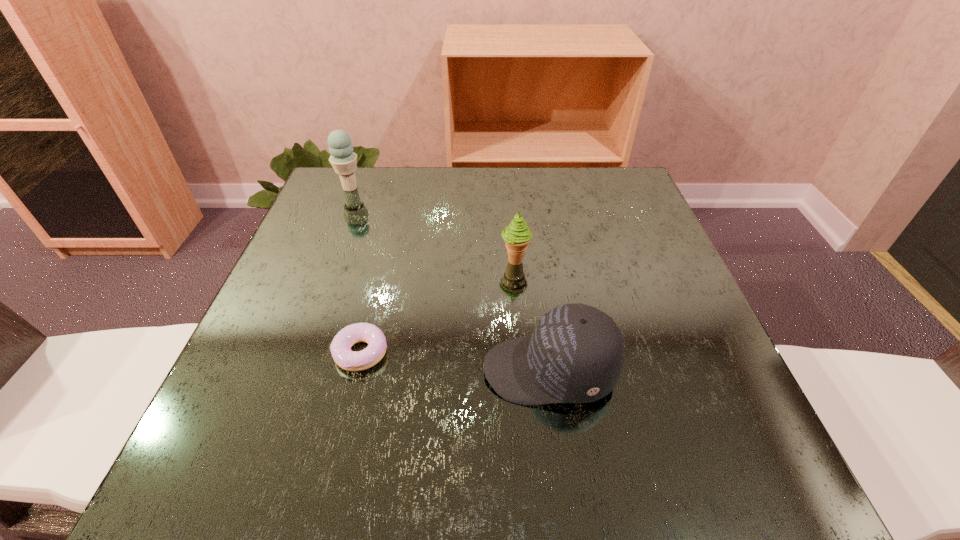
In the image, there is a desktop. Where is `vacant space at the right edge`? vacant space at the right edge is located at coordinates (664, 242).

I want to click on free space at the far left corner of the desktop, so click(324, 199).

In the image, there is a desktop. At what (x,y) coordinates should I click in order to perform the action: click on vacant area at the near left corner. Please return your answer as a coordinate pair (x, y). Image resolution: width=960 pixels, height=540 pixels. Looking at the image, I should click on (208, 474).

In the image, there is a desktop. Where is `vacant area at the far right corner`? The width and height of the screenshot is (960, 540). vacant area at the far right corner is located at coordinates (599, 192).

You are a GUI agent. You are given a task and a screenshot of the screen. Output one action in this format:
    pyautogui.click(x=<x>, y=<y>)
    Task: Click on the vacant area that lies between the tallest object and the baseball cap
    This screenshot has height=540, width=960.
    Given the screenshot: What is the action you would take?
    pyautogui.click(x=450, y=279)

The width and height of the screenshot is (960, 540). Identify the location of free space between the baseball cap and the doughnut. (455, 361).

I want to click on free spot between the right icecream and the third object from right to left, so click(438, 306).

The width and height of the screenshot is (960, 540). In order to click on free area in between the baseball cap and the shorter icecream in this screenshot , I will do `click(532, 315)`.

Find the location of a particular element. The height and width of the screenshot is (540, 960). free spot between the right icecream and the baseball cap is located at coordinates (532, 315).

Locate an element on the screen. The image size is (960, 540). blank region between the baseball cap and the second farthest object is located at coordinates (532, 315).